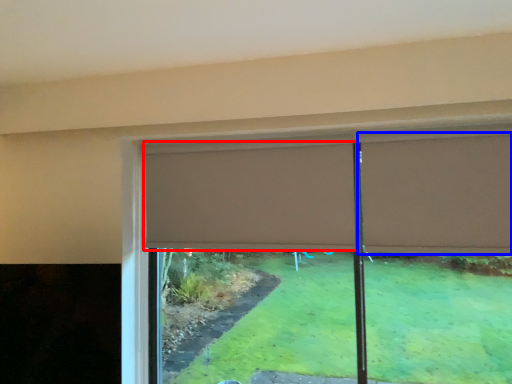
Question: Which of the following is the farthest to the observer, curtain (highlighted by a red box) or curtain (highlighted by a blue box)?

Choices:
 (A) curtain
 (B) curtain

Answer: (A)